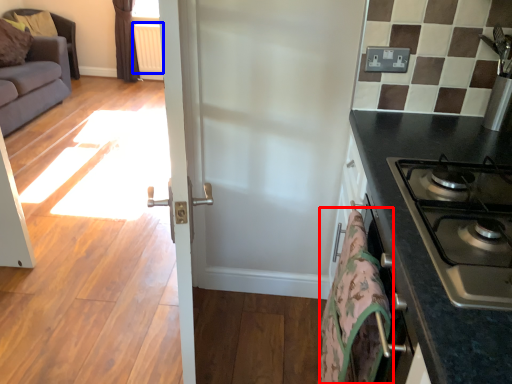
Question: Which object appears farthest to the camera in this image, blanket (highlighted by a red box) or radiator (highlighted by a blue box)?

Choices:
 (A) blanket
 (B) radiator

Answer: (B)